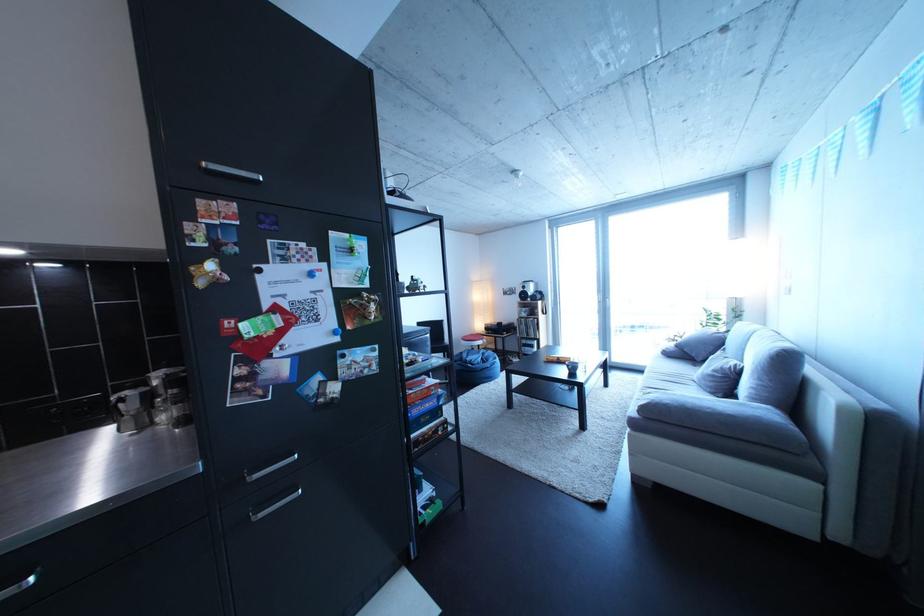
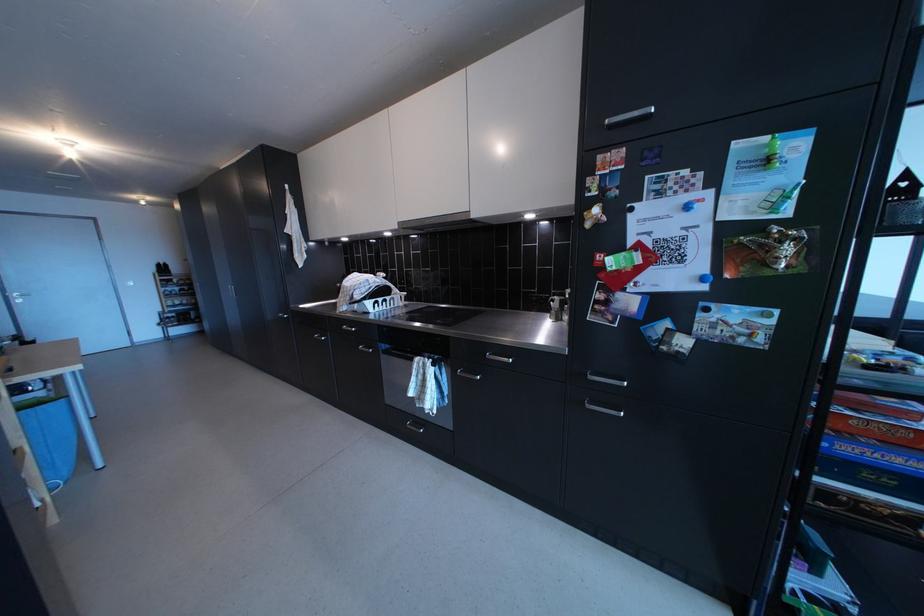
Question: Based on the continuous images, in which direction is the camera rotating? Reply with the corresponding letter.

Choices:
 (A) Left
 (B) Right
 (C) Up
 (D) Down

Answer: (A)